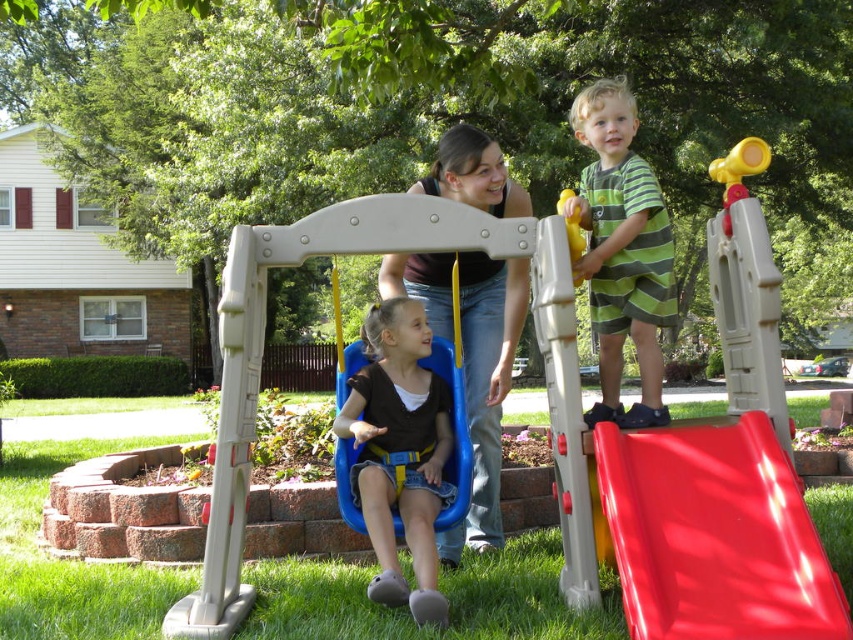
Is yellow plastic handle at upper right to the right of yellow plastic slide at upper right from the viewer's perspective?

Yes, yellow plastic handle at upper right is to the right of yellow plastic slide at upper right.

Does yellow plastic handle at upper right have a larger size compared to yellow plastic slide at upper right?

Yes.

Is point (753, 168) less distant than point (578, 241)?

Yes.

The width and height of the screenshot is (853, 640). In order to click on yellow plastic handle at upper right in this screenshot , I will do (x=738, y=172).

Does point (604, 413) come behind point (581, 241)?

Yes, point (604, 413) is behind point (581, 241).

Does green striped shirt at upper right appear on the right side of yellow plastic slide at upper right?

Yes, green striped shirt at upper right is to the right of yellow plastic slide at upper right.

Which is in front, point (651, 234) or point (573, 211)?

Point (573, 211)

At what (x,y) coordinates should I click in order to perform the action: click on green striped shirt at upper right. Please return your answer as a coordinate pair (x, y). This screenshot has width=853, height=640. Looking at the image, I should click on (622, 252).

Between green striped shirt at upper right and yellow plastic handle at upper right, which one appears on the left side from the viewer's perspective?

green striped shirt at upper right

Between green striped shirt at upper right and yellow plastic handle at upper right, which one appears on the right side from the viewer's perspective?

Positioned to the right is yellow plastic handle at upper right.

Is point (596, 252) closer to camera compared to point (726, 200)?

No, (596, 252) is further to viewer.

Where is `green striped shirt at upper right`? The height and width of the screenshot is (640, 853). green striped shirt at upper right is located at coordinates (622, 252).